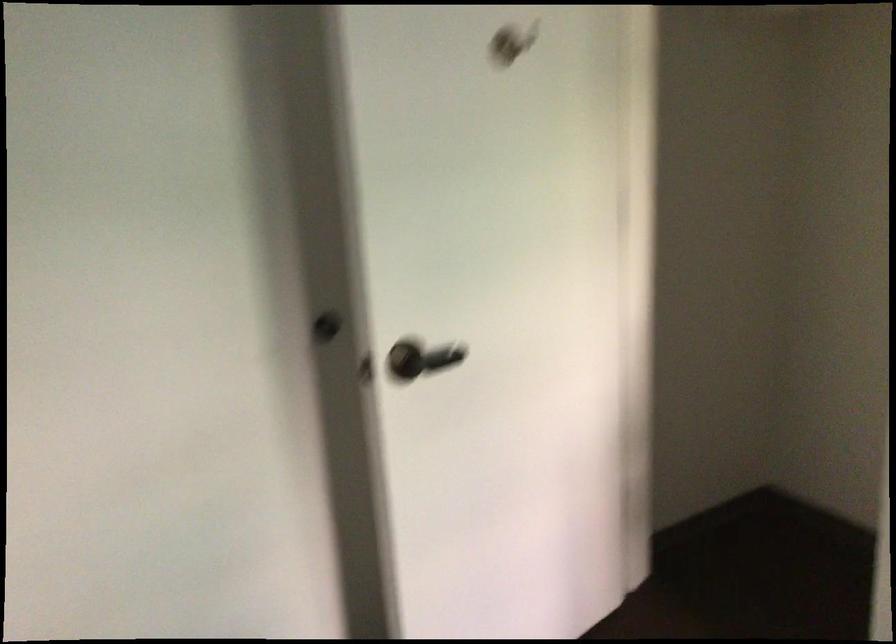
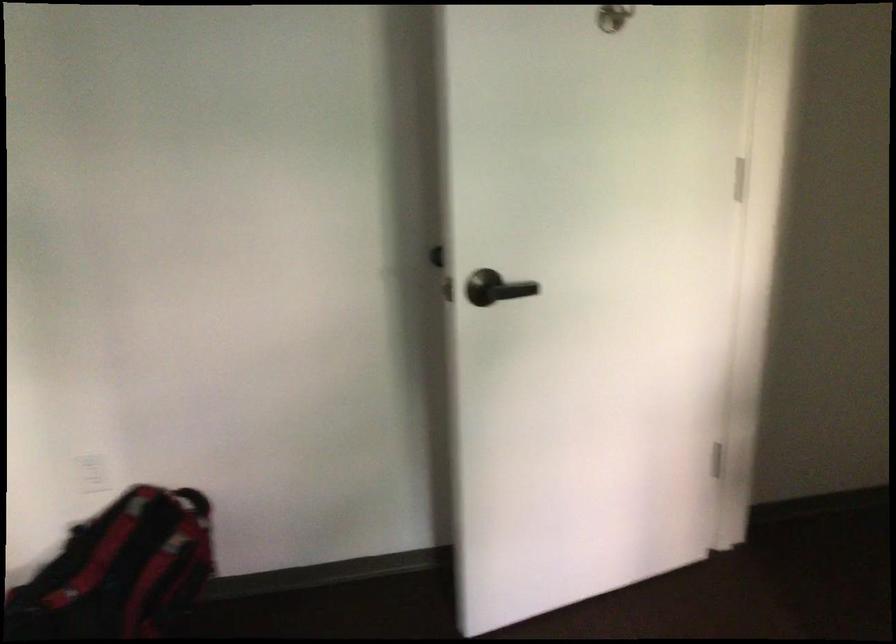
In the second image, find the point that corresponds to (x=421, y=361) in the first image.

(495, 288)